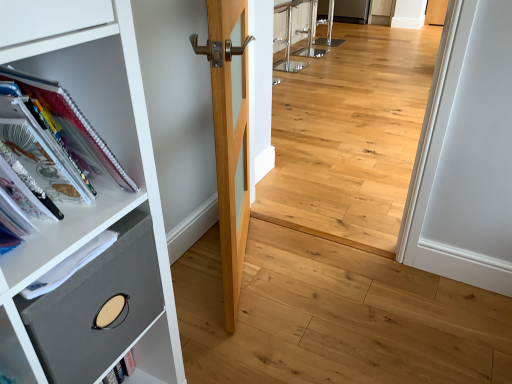
The width and height of the screenshot is (512, 384). In order to click on spots to the right of light wood door at center in this screenshot , I will do `click(332, 288)`.